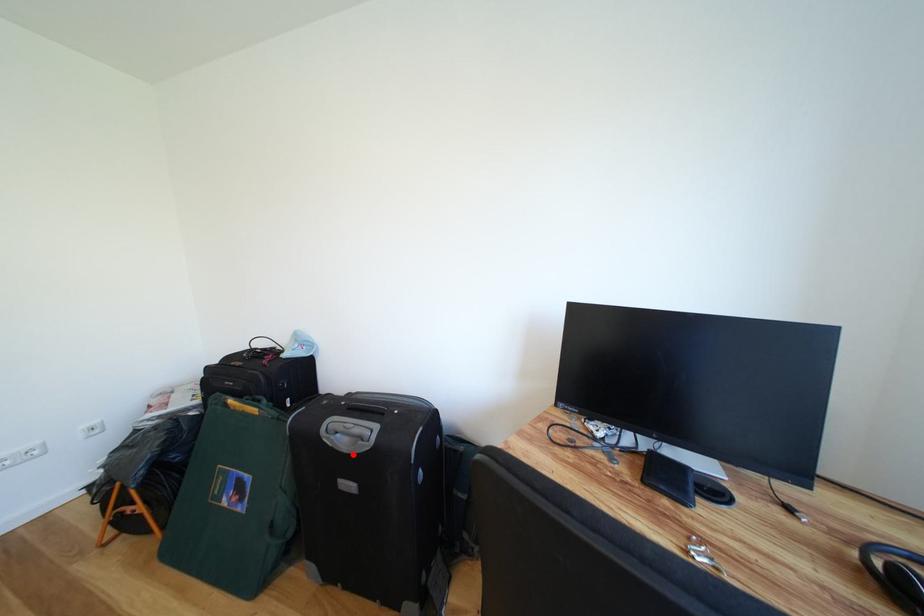
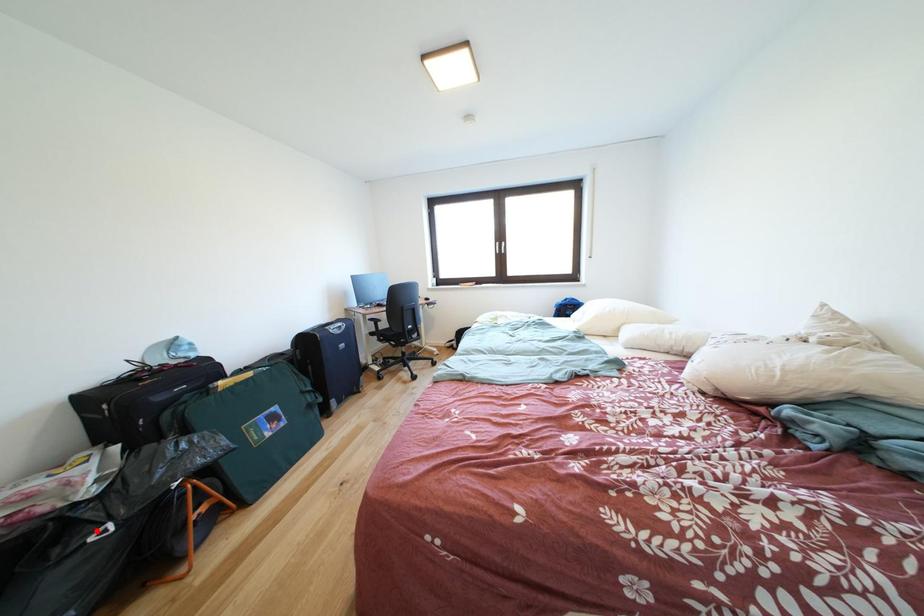
I am providing you with two images of the same scene from different viewpoints. A red point is marked on the first image and another point is marked on the second image. Does the point marked in image1 correspond to the same location as the one in image2?

No